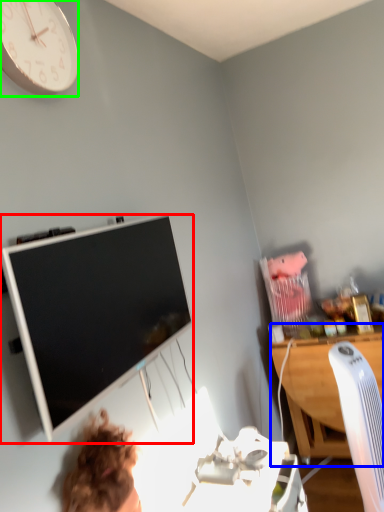
Question: Which is nearer to the television (highlighted by a red box)? desk (highlighted by a blue box) or wall clock (highlighted by a green box).

Choices:
 (A) desk
 (B) wall clock

Answer: (B)